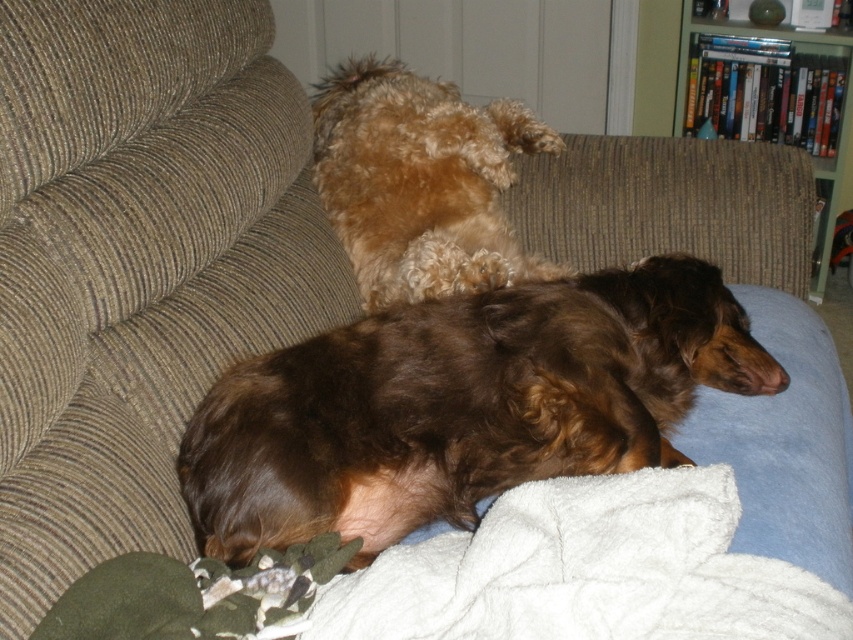
Is brown curly fur dog at center smaller than wooden bookshelf at upper right?

Yes.

Measure the distance between point (570, 448) and camera.

Point (570, 448) and camera are 1.12 meters apart from each other.

Locate an element on the screen. The width and height of the screenshot is (853, 640). brown curly fur dog at center is located at coordinates (460, 404).

Can you confirm if fuzzy brown dog at upper center is taller than wooden bookshelf at upper right?

No.

Can you confirm if fuzzy brown dog at upper center is positioned to the left of wooden bookshelf at upper right?

Correct, you'll find fuzzy brown dog at upper center to the left of wooden bookshelf at upper right.

The image size is (853, 640). What are the coordinates of `fuzzy brown dog at upper center` in the screenshot? It's located at (421, 180).

Is brown curly fur dog at center behind white soft blanket at lower center?

Yes.

From the picture: Which is below, brown curly fur dog at center or white soft blanket at lower center?

white soft blanket at lower center is lower down.

Which is behind, point (583, 392) or point (701, 564)?

The point (583, 392) is behind.

Locate an element on the screen. Image resolution: width=853 pixels, height=640 pixels. brown curly fur dog at center is located at coordinates (460, 404).